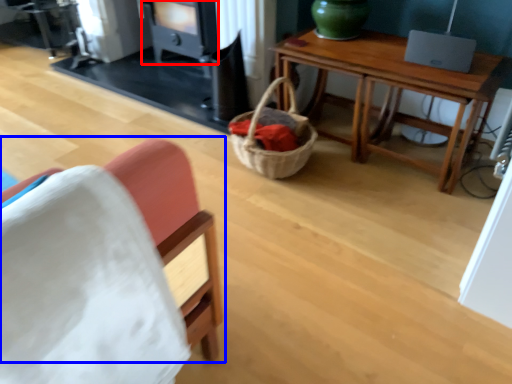
Question: Which object is closer to the camera taking this photo, stove (highlighted by a red box) or chair (highlighted by a blue box)?

Choices:
 (A) stove
 (B) chair

Answer: (B)